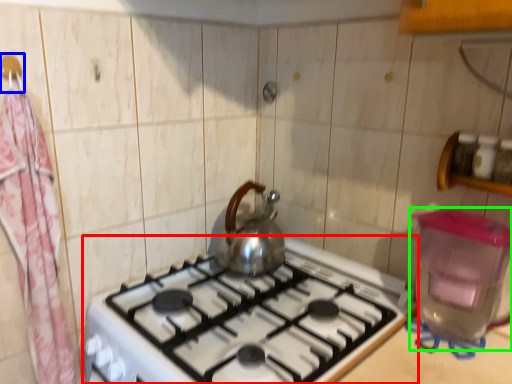
Question: Considering the real-world distances, which object is closest to gas stove (highlighted by a red box)? hanger (highlighted by a blue box) or water heater (highlighted by a green box).

Choices:
 (A) hanger
 (B) water heater

Answer: (B)